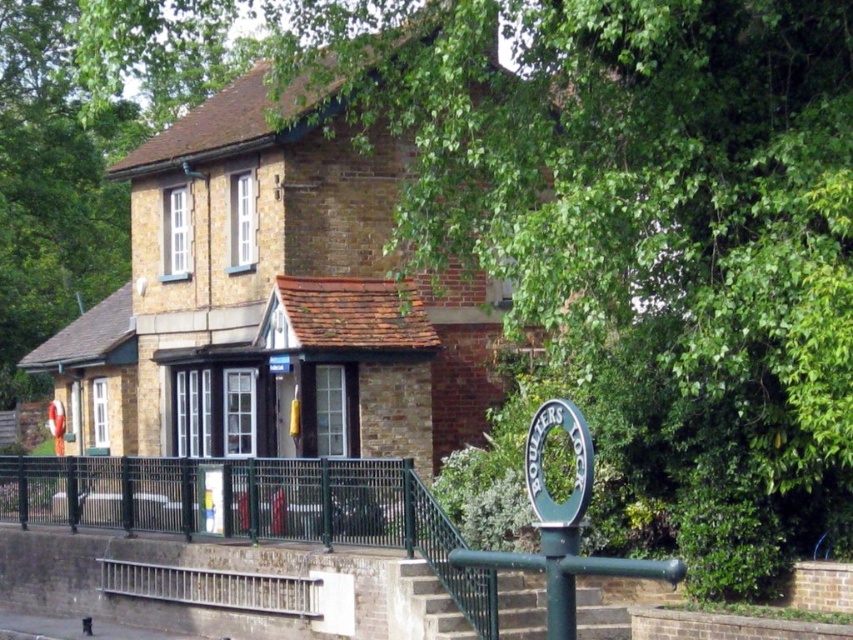
You are a delivery person approaching the building and need to read the green plastic sign at lower right. The sign is placed next to the green metallic pole at lower right. Which object has a greater width?

The green plastic sign at lower right has a greater width than the green metallic pole at lower right.

You are a maintenance worker tasked with replacing the green metal railing at lower center and the green metallic pole at lower right. If you have a limited amount of green paint, which object requires more paint to repaint?

The green metal railing at lower center requires more paint because it is larger in size than the green metallic pole at lower right.

You are standing in front of the building and want to walk towards the entrance. Which object should you pass first, the green metal railing at lower center or the green metallic pole at lower right?

You should pass the green metal railing at lower center first because it is located to the left of the green metallic pole at lower right, so from your perspective facing the entrance, you would encounter the railing before reaching the pole.